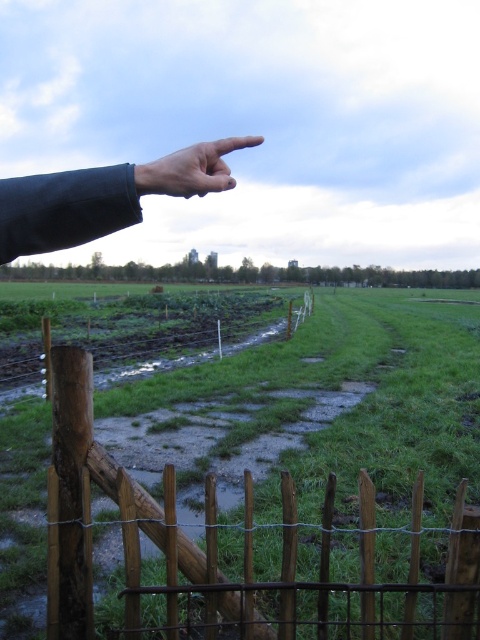
You are standing in a rural area and see a green grassy field at center and a dark skin hand at upper left. Which object is located to the right of the other?

The green grassy field at center is located to the right of the dark skin hand at upper left.

You are standing at the fence and want to reach the green grassy field at center. The fence is 1.5 meters wide. Can you step over the fence to get to the field?

The distance between the fence and the green grassy field at center is 2.29 meters. Since the fence is 1.5 meters wide, stepping over it might be challenging as the gap is wider than average. Consider finding another way over or around the fence.